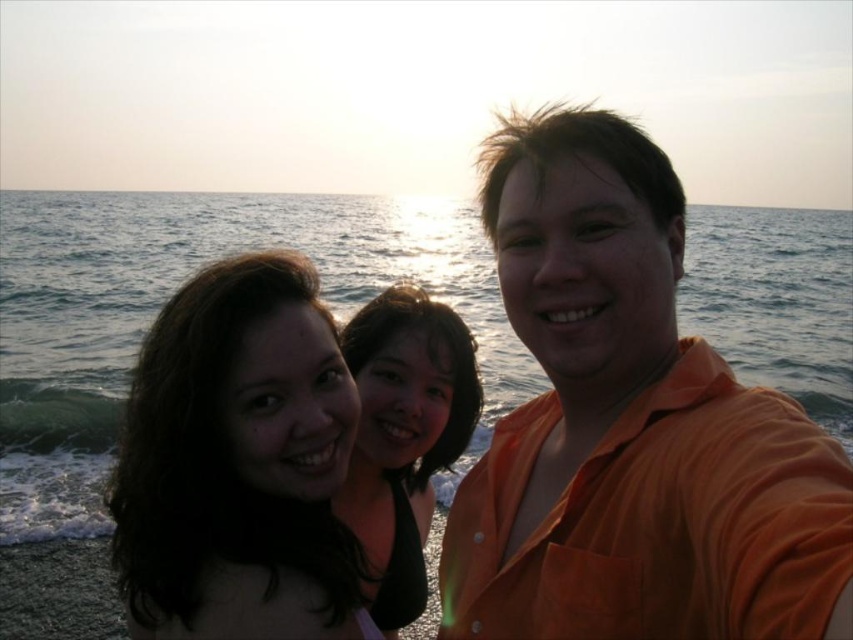
Question: Is orange cotton shirt at right in front of black matte hair at center?

Choices:
 (A) no
 (B) yes

Answer: (B)

Question: Which object is closer to the camera taking this photo?

Choices:
 (A) dark brown hair at center
 (B) black matte hair at center
 (C) blue water at center
 (D) orange cotton shirt at right

Answer: (D)

Question: Does orange cotton shirt at right appear under black matte hair at center?

Choices:
 (A) yes
 (B) no

Answer: (B)

Question: Among these points, which one is nearest to the camera?

Choices:
 (A) (285, 524)
 (B) (397, 579)
 (C) (244, 204)
 (D) (558, 198)

Answer: (D)

Question: Which object is positioned farthest from the dark brown hair at center?

Choices:
 (A) orange cotton shirt at right
 (B) black matte hair at center

Answer: (A)

Question: Is blue water at center wider than black matte hair at center?

Choices:
 (A) no
 (B) yes

Answer: (B)